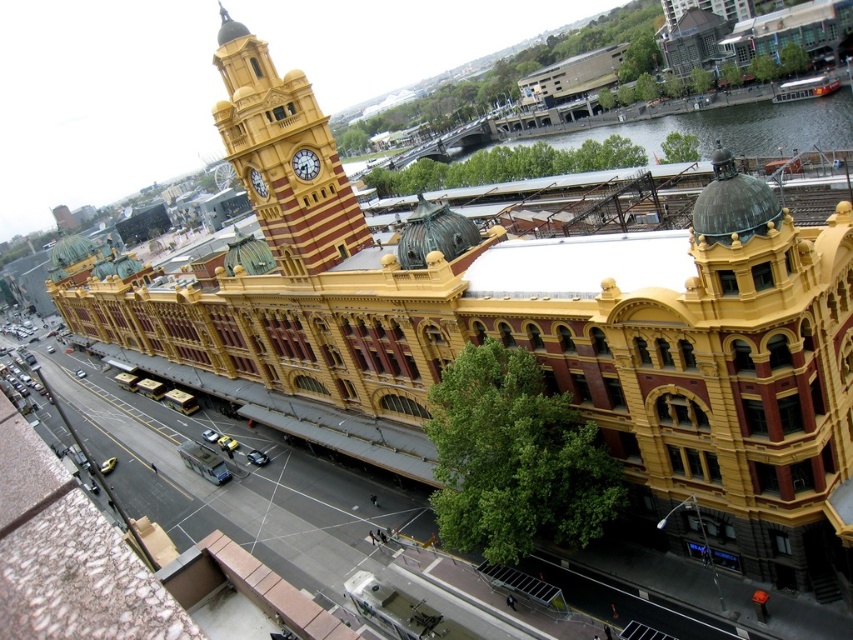
Question: Can you confirm if golden textured clock tower at upper left is bigger than green water at upper right?

Choices:
 (A) yes
 (B) no

Answer: (B)

Question: Which point appears farthest from the camera in this image?

Choices:
 (A) pos(544,136)
 (B) pos(296,172)

Answer: (A)

Question: Observing the image, what is the correct spatial positioning of gold metallic clock at center in reference to gold metallic clock at upper center?

Choices:
 (A) left
 (B) right

Answer: (B)

Question: Observing the image, what is the correct spatial positioning of golden textured clock tower at upper left in reference to gold metallic clock at center?

Choices:
 (A) above
 (B) below

Answer: (A)

Question: Considering the real-world distances, which object is farthest from the golden textured clock tower at upper left?

Choices:
 (A) gold metallic clock at upper center
 (B) green water at upper right
 (C) gold metallic clock at center

Answer: (B)

Question: Which of these objects is positioned farthest from the gold metallic clock at center?

Choices:
 (A) golden textured clock tower at upper left
 (B) gold metallic clock at upper center
 (C) green water at upper right

Answer: (C)